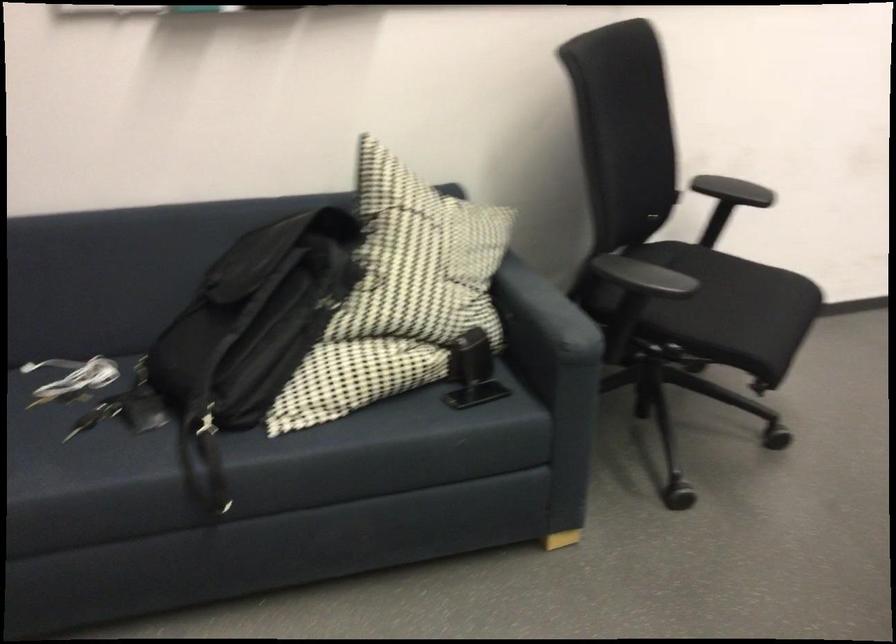
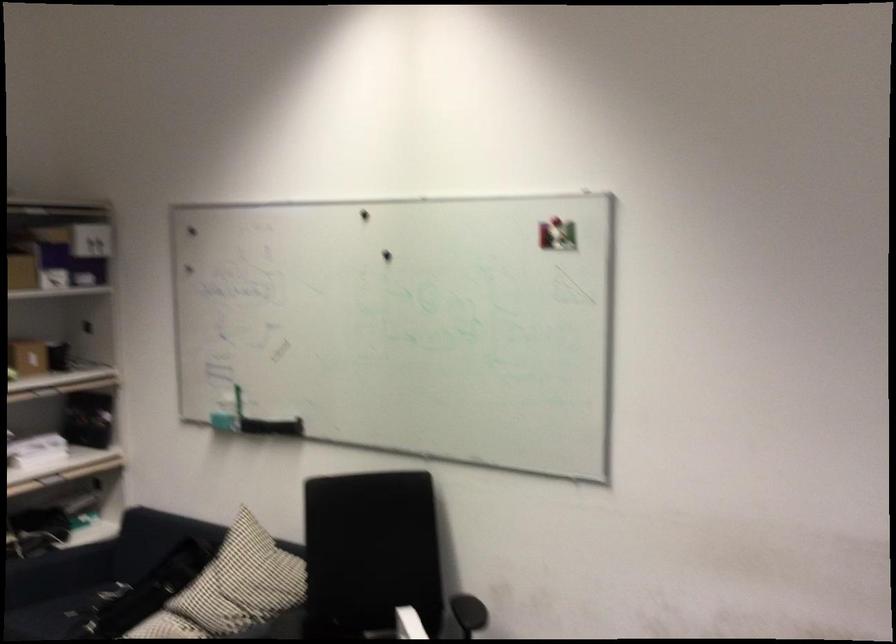
Locate, in the second image, the point that corresponds to (x=431, y=261) in the first image.

(231, 588)